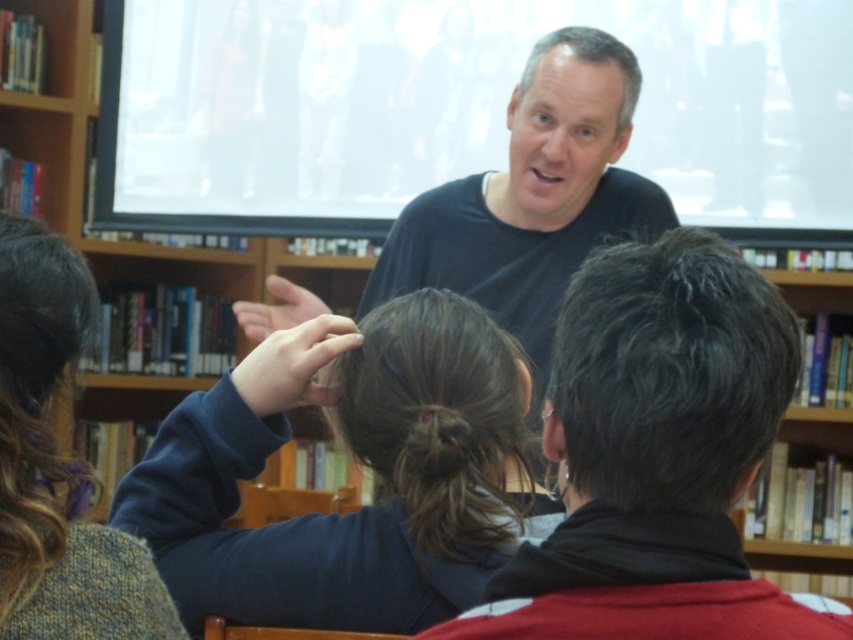
You are a tailor observing a group of people in a library. You need to determine which sweater is bigger between the dark blue sweater at center and the knitted sweater at lower left. Which one is larger?

The dark blue sweater at center is larger than the knitted sweater at lower left.

You are organizing a bookshelf in the library and need to place two items on a shelf that is 12 inches wide. The items are the dark blue sweater at center and the knitted sweater at lower left. Can both items fit side by side on the shelf?

The dark blue sweater at center and knitted sweater at lower left are 11.72 inches apart, so they can fit side by side on a 12 inch wide shelf since the total width required is less than the shelf width.